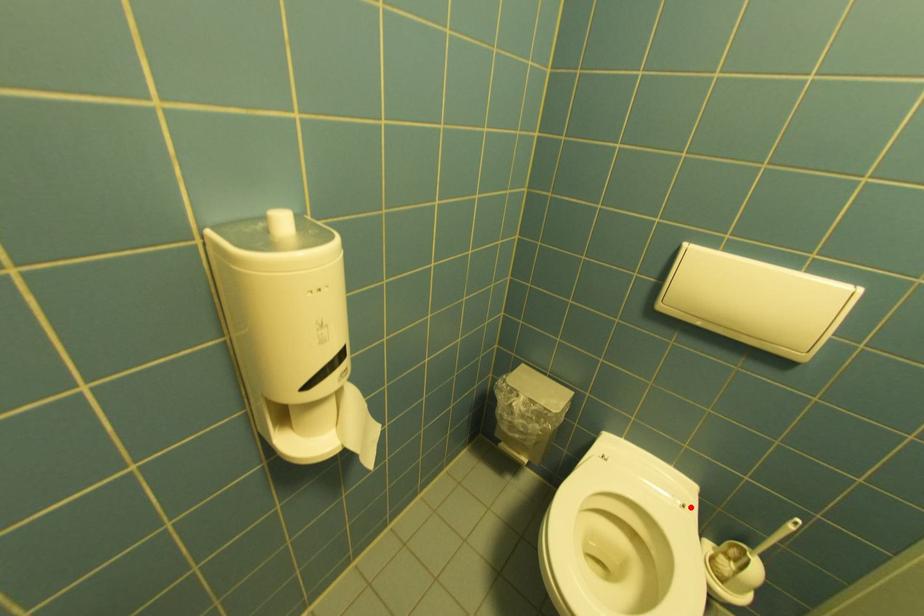
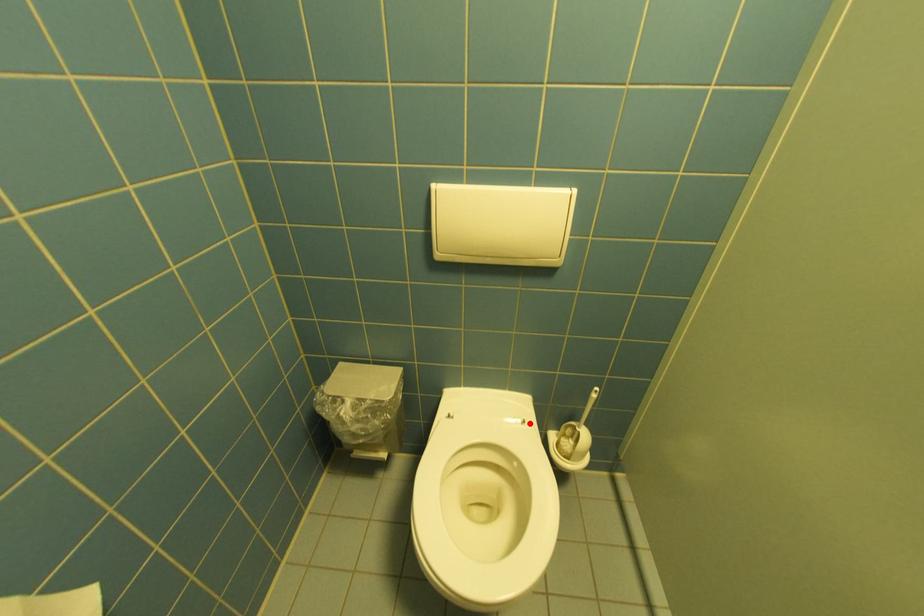
I am providing you with two images of the same scene from different viewpoints. A red point is marked on the first image and another point is marked on the second image. Is the red point in image1 aligned with the point shown in image2?

Yes